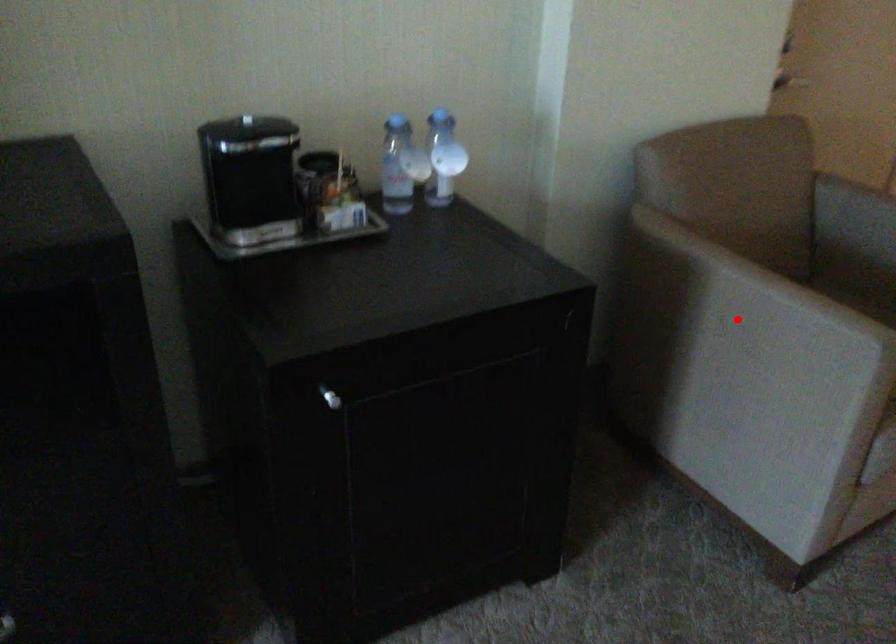
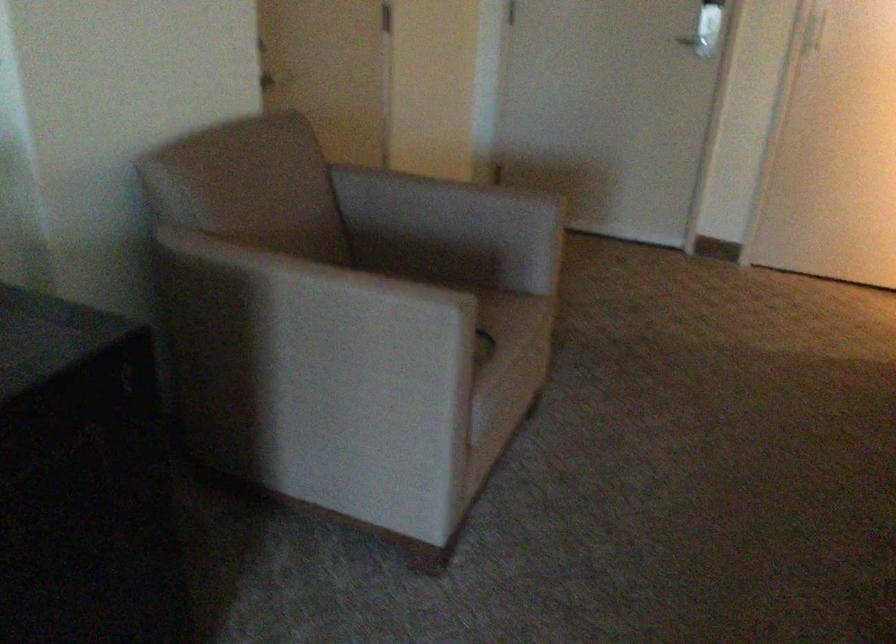
Find the pixel in the second image that matches the highlighted location in the first image.

(314, 325)